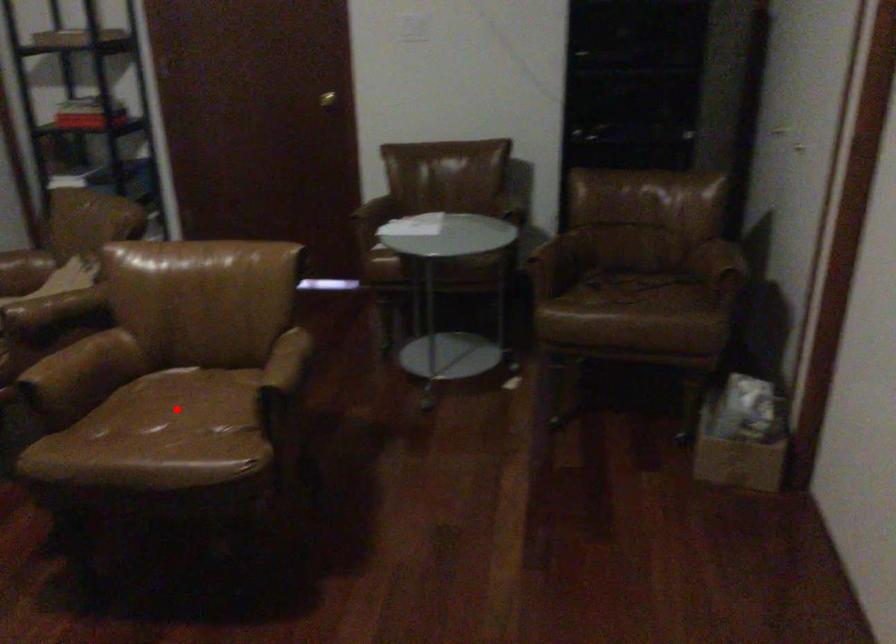
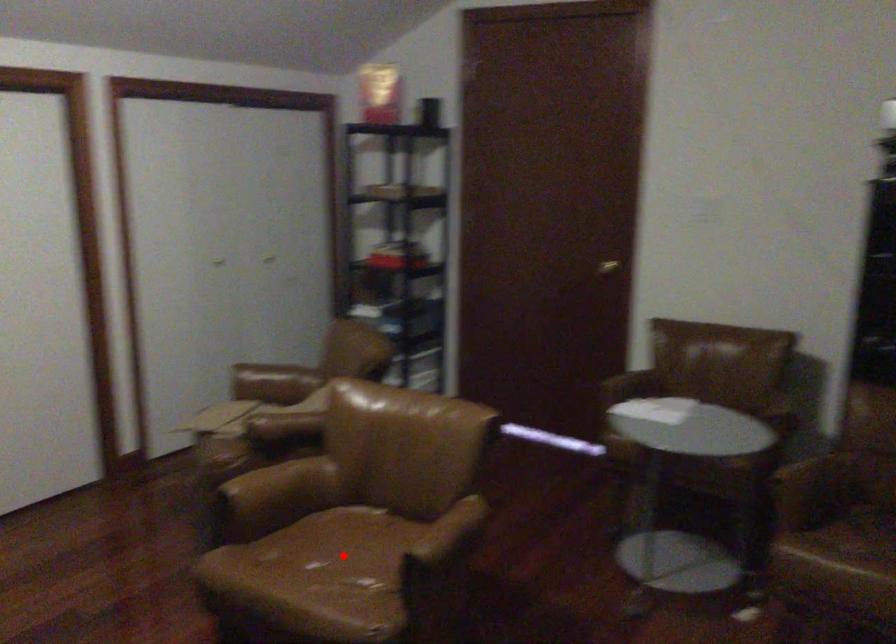
I am providing you with two images of the same scene from different viewpoints. A red point is marked on the first image and another point is marked on the second image. Do the highlighted points in image1 and image2 indicate the same real-world spot?

Yes